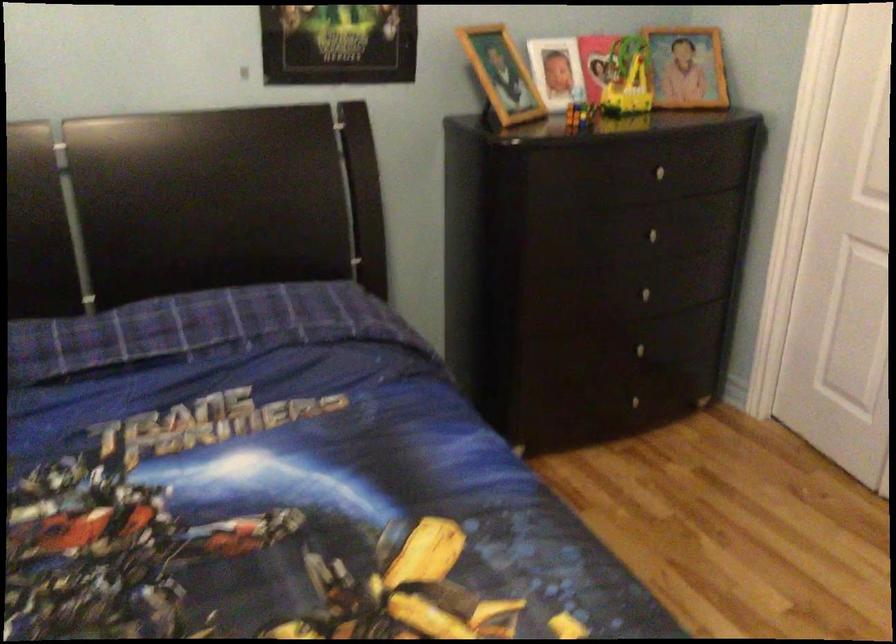
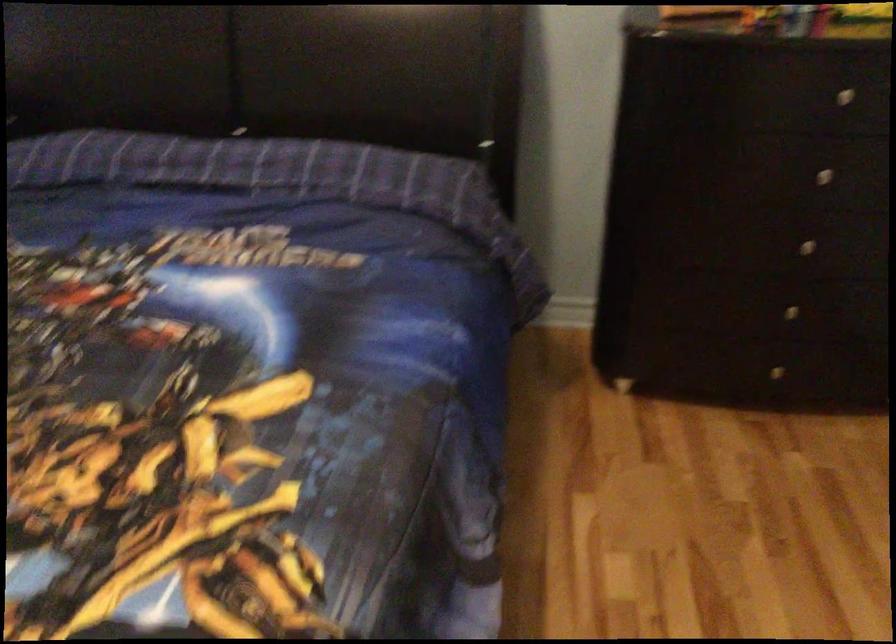
Locate, in the second image, the point that corresponds to point (666, 166) in the first image.

(858, 91)